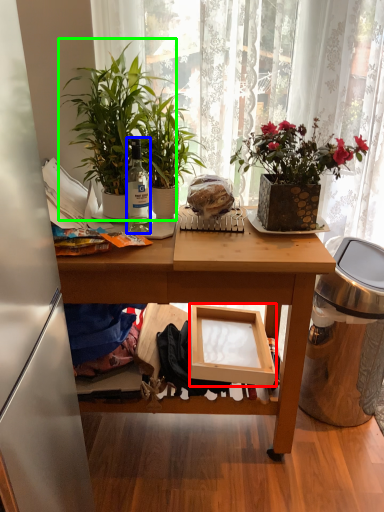
Question: Estimate the real-world distances between objects in this image. Which object is closer to box (highlighted by a red box), bottle (highlighted by a blue box) or houseplant (highlighted by a green box)?

Choices:
 (A) bottle
 (B) houseplant

Answer: (A)